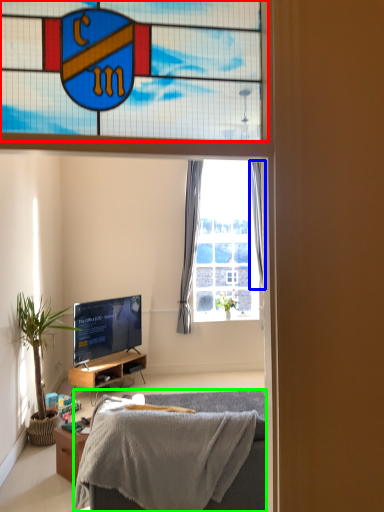
Question: Which object is positioned farthest from window (highlighted by a red box)? Select from curtain (highlighted by a blue box) and bed (highlighted by a green box).

Choices:
 (A) curtain
 (B) bed

Answer: (B)